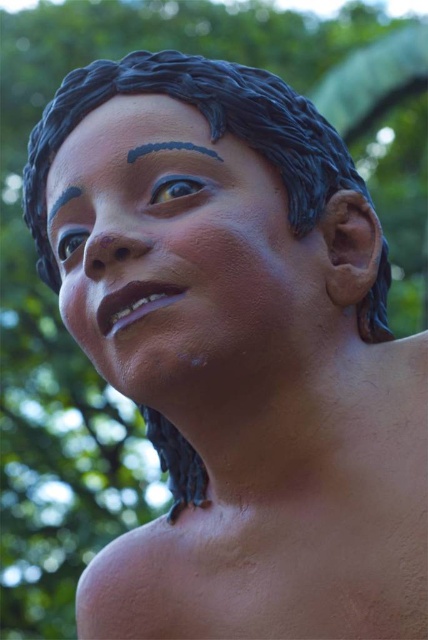
You are an art restorer examining the statue of the child. You notice two eyebrows on the statue. Which one is shorter between the blue matte eyebrow at upper center and the black matte eyebrow at upper left?

The blue matte eyebrow at upper center is shorter than the black matte eyebrow at upper left.

Looking at the statue of the child, which object is shorter between the blue matte eyebrow at upper center and the matte blue eye at upper left?

The blue matte eyebrow at upper center is shorter than the matte blue eye at upper left.